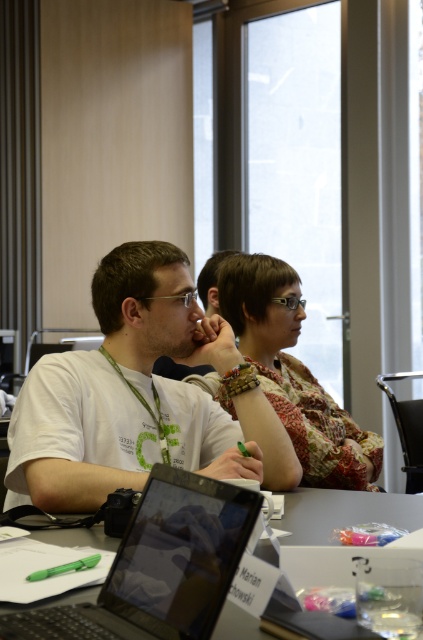
Measure the distance between matte black laptop at center and camera.

matte black laptop at center and camera are 33.66 inches apart.

Between point (143, 612) and point (316, 404), which one is positioned behind?

The point (316, 404) is behind.

Is point (208, 556) behind point (368, 433)?

No.

I want to click on matte black laptop at center, so click(159, 566).

Does white matte t-shirt at center appear under patterned fabric blouse at center?

Correct, white matte t-shirt at center is located below patterned fabric blouse at center.

At what (x,y) coordinates should I click in order to perform the action: click on white matte t-shirt at center. Please return your answer as a coordinate pair (x, y). Looking at the image, I should click on (140, 396).

Image resolution: width=423 pixels, height=640 pixels. I want to click on white matte t-shirt at center, so click(x=140, y=396).

Between point (95, 275) and point (211, 600), which one is positioned behind?

The point (95, 275) is behind.

Which is more to the right, white matte t-shirt at center or matte black laptop at center?

white matte t-shirt at center is more to the right.

What do you see at coordinates (140, 396) in the screenshot? The width and height of the screenshot is (423, 640). I see `white matte t-shirt at center` at bounding box center [140, 396].

The width and height of the screenshot is (423, 640). Find the location of `white matte t-shirt at center`. white matte t-shirt at center is located at coordinates (140, 396).